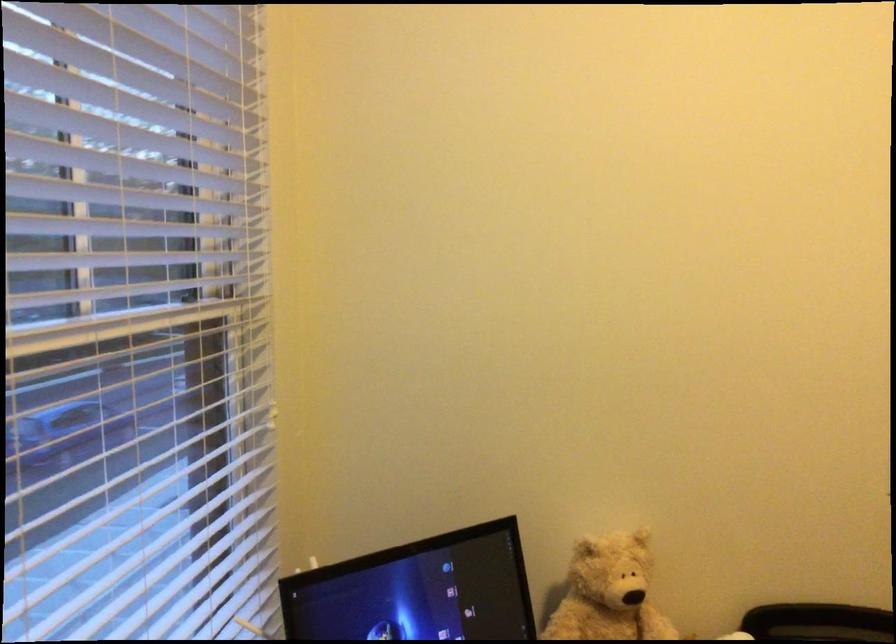
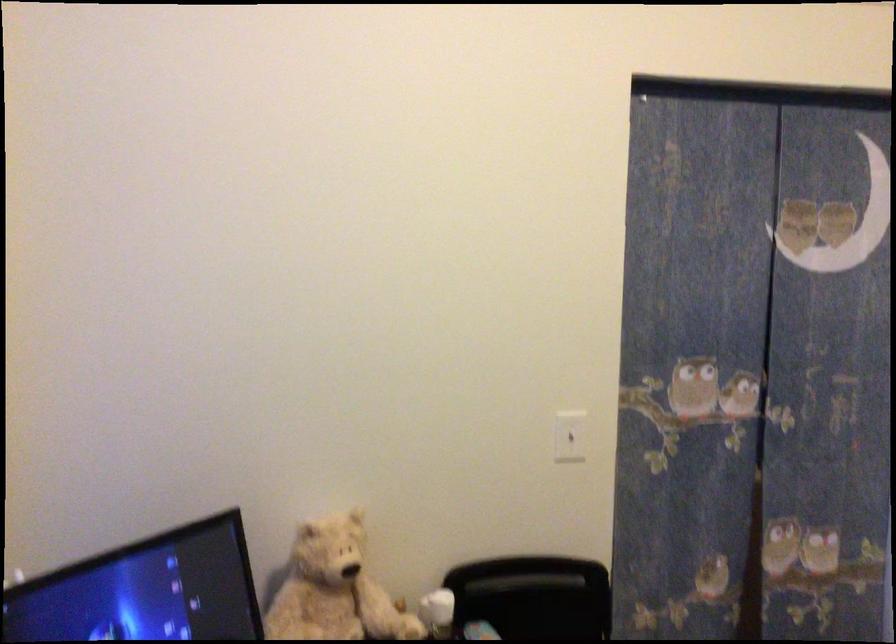
Question: Which direction would the cameraman need to move to produce the second image? Reply with the corresponding letter.

Choices:
 (A) Left
 (B) Right
 (C) Forward
 (D) Backward

Answer: (D)